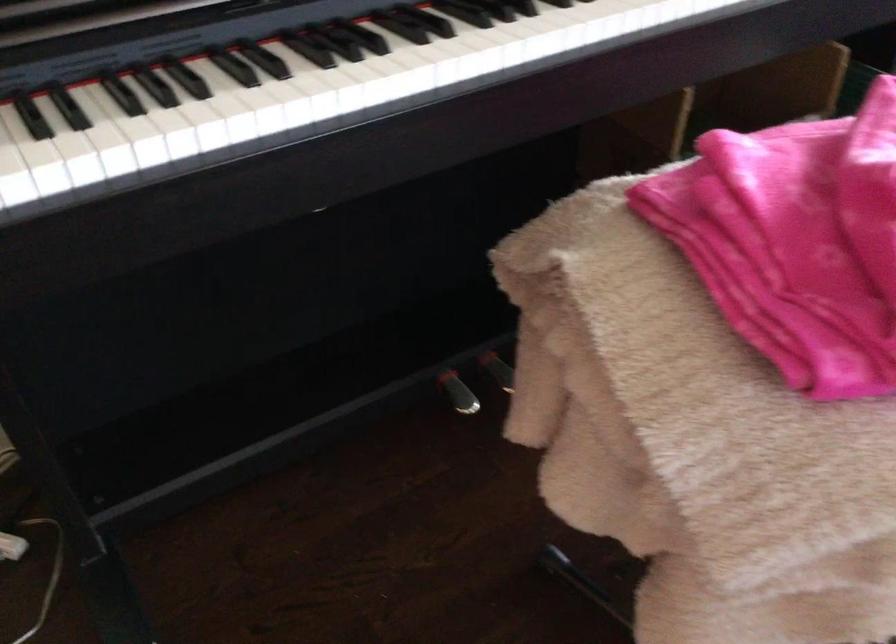
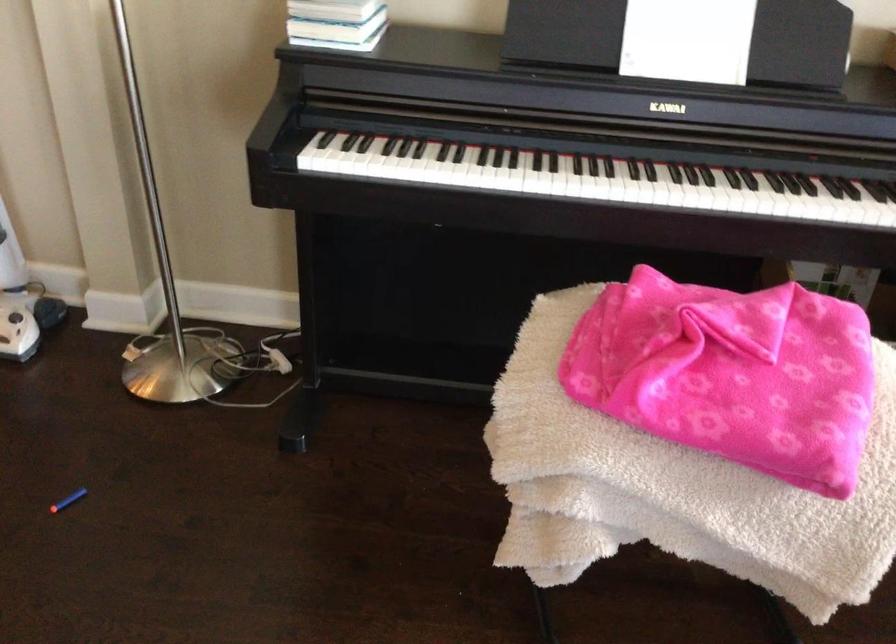
Question: The images are taken continuously from a first-person perspective. In which direction is your viewpoint rotating?

Choices:
 (A) Left
 (B) Right
 (C) Up
 (D) Down

Answer: (A)